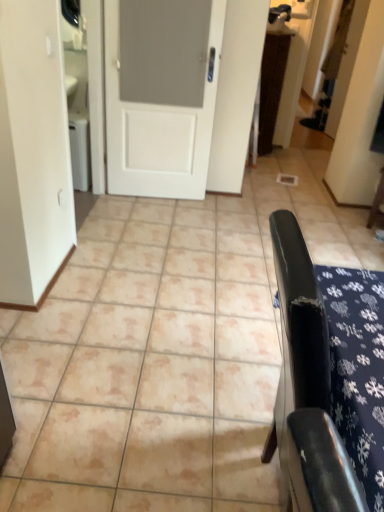
This screenshot has height=512, width=384. Find the location of `vacant area that lies in front of white matte door at center`. vacant area that lies in front of white matte door at center is located at coordinates (152, 218).